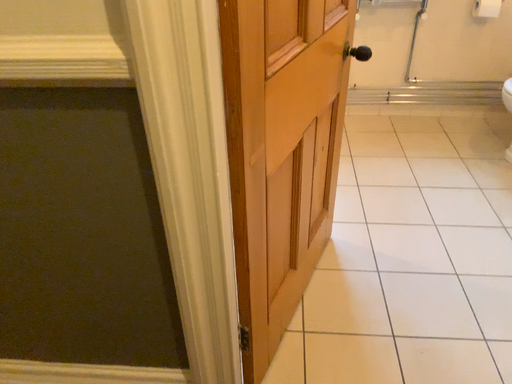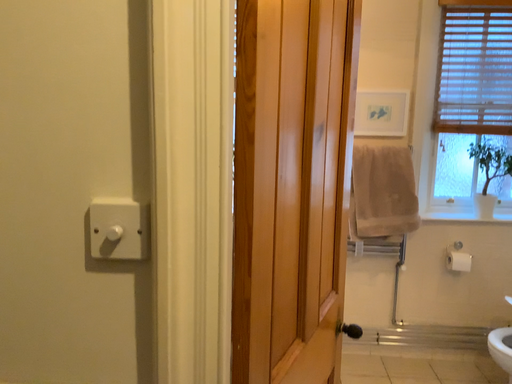
Question: How did the camera likely rotate when shooting the video?

Choices:
 (A) rotated upward
 (B) rotated downward

Answer: (A)